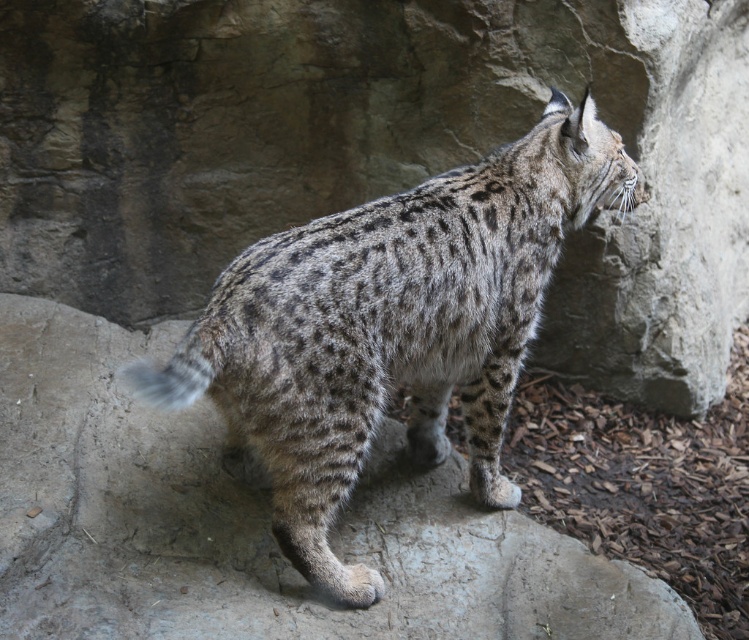
Can you confirm if gray textured rock at center is positioned below spotted fur cat at center?

Indeed, gray textured rock at center is positioned under spotted fur cat at center.

Is gray textured rock at center in front of spotted fur cat at center?

No, gray textured rock at center is behind spotted fur cat at center.

You are a GUI agent. You are given a task and a screenshot of the screen. Output one action in this format:
    pyautogui.click(x=<x>, y=<y>)
    Task: Click on the gray textured rock at center
    This screenshot has width=749, height=640.
    Given the screenshot: What is the action you would take?
    pyautogui.click(x=252, y=522)

Image resolution: width=749 pixels, height=640 pixels. I want to click on gray textured rock at center, so click(x=252, y=522).